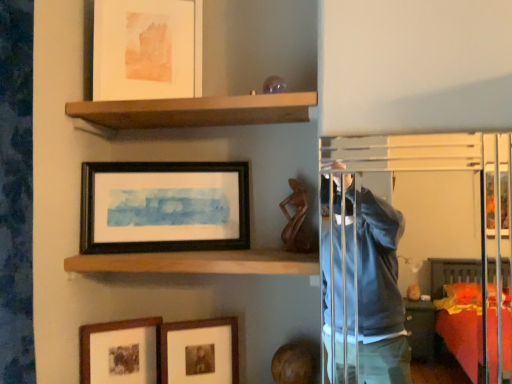
Question: Is black matte picture frame at center, acting as the 3th picture frame starting from the bottom, to the left or to the right of brown wooden shelf at upper center, the 2th shelf in the bottom-to-top sequence, in the image?

Choices:
 (A) right
 (B) left

Answer: (B)

Question: Is black matte picture frame at center, acting as the 3th picture frame starting from the bottom, wider or thinner than brown wooden shelf at upper center, the 2th shelf in the bottom-to-top sequence?

Choices:
 (A) thin
 (B) wide

Answer: (A)

Question: Based on their relative distances, which object is nearer to the transparent glass door at upper right?

Choices:
 (A) matte wooden picture frame at lower left, the fourth picture frame from the top
 (B) black matte picture frame at center, arranged as the 2th picture frame when viewed from the top
 (C) brown wooden shelf at upper center, the 2th shelf in the bottom-to-top sequence
 (D) matte paper picture frame at upper center, the 4th picture frame in the bottom-to-top sequence
 (E) wooden shelf at center, the 2th shelf positioned from the top

Answer: (E)

Question: Which of these objects is positioned farthest from the brown wooden shelf at upper center, which is the 1th shelf from top to bottom?

Choices:
 (A) wooden head at lower center
 (B) black matte picture frame at center, acting as the 3th picture frame starting from the bottom
 (C) matte wooden picture frame at lower left, marked as the 1th picture frame in a bottom-to-top arrangement
 (D) transparent glass door at upper right
 (E) matte paper picture frame at upper center, the 4th picture frame in the bottom-to-top sequence

Answer: (A)